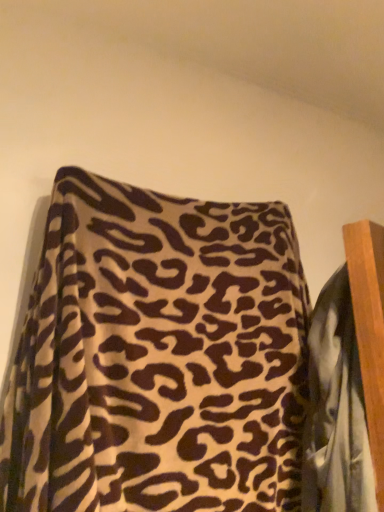
Question: From the image's perspective, is leopard print fabric at upper center above or below leopard print fabric at center?

Choices:
 (A) above
 (B) below

Answer: (A)

Question: Is leopard print fabric at upper center taller or shorter than leopard print fabric at center?

Choices:
 (A) tall
 (B) short

Answer: (A)

Question: Looking at their shapes, would you say leopard print fabric at upper center is wider or thinner than leopard print fabric at center?

Choices:
 (A) wide
 (B) thin

Answer: (A)

Question: Looking at their shapes, would you say leopard print fabric at center is wider or thinner than leopard print fabric at upper center?

Choices:
 (A) thin
 (B) wide

Answer: (A)

Question: Is leopard print fabric at center inside or outside of leopard print fabric at upper center?

Choices:
 (A) inside
 (B) outside

Answer: (A)

Question: Based on their sizes in the image, would you say leopard print fabric at center is bigger or smaller than leopard print fabric at upper center?

Choices:
 (A) big
 (B) small

Answer: (B)

Question: Is point (365, 444) closer or farther from the camera than point (23, 441)?

Choices:
 (A) closer
 (B) farther

Answer: (B)